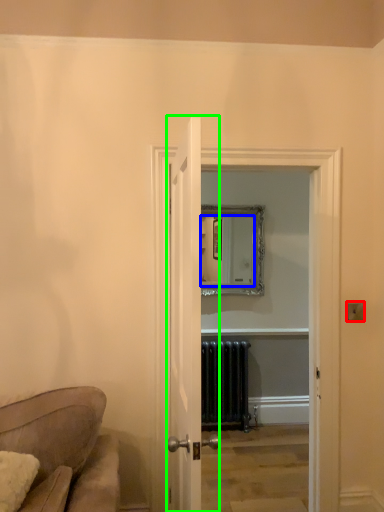
Question: Estimate the real-world distances between objects in this image. Which object is closer to light switch (highlighted by a red box), mirror (highlighted by a blue box) or door (highlighted by a green box)?

Choices:
 (A) mirror
 (B) door

Answer: (B)